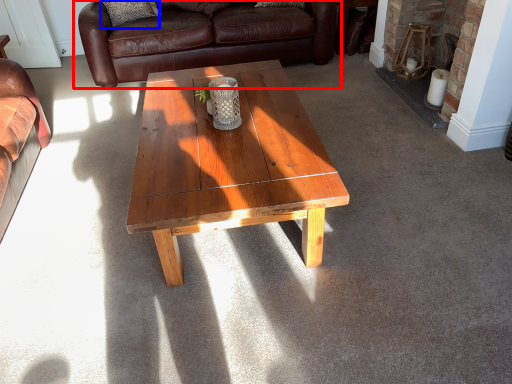
Question: Which object is further to the camera taking this photo, studio couch (highlighted by a red box) or pillow (highlighted by a blue box)?

Choices:
 (A) studio couch
 (B) pillow

Answer: (B)